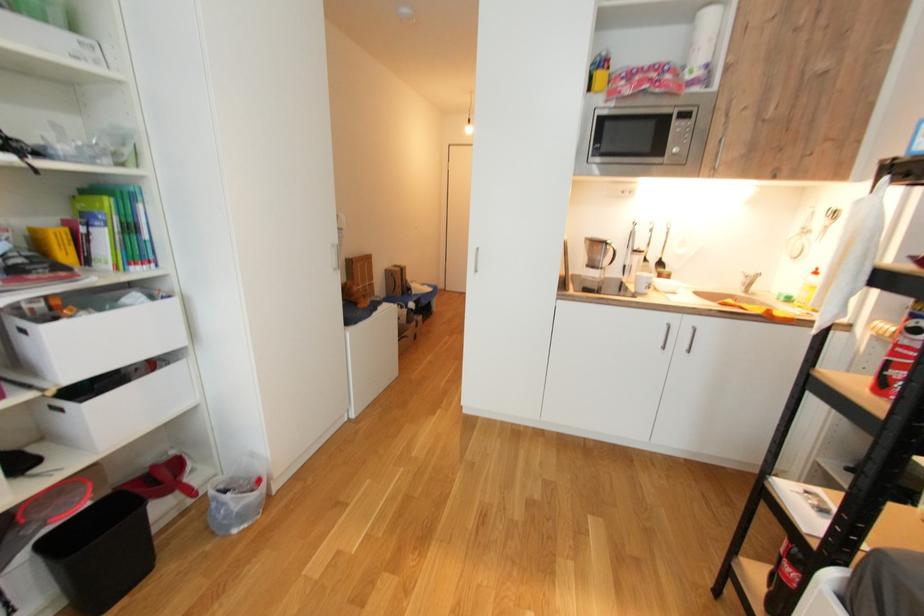
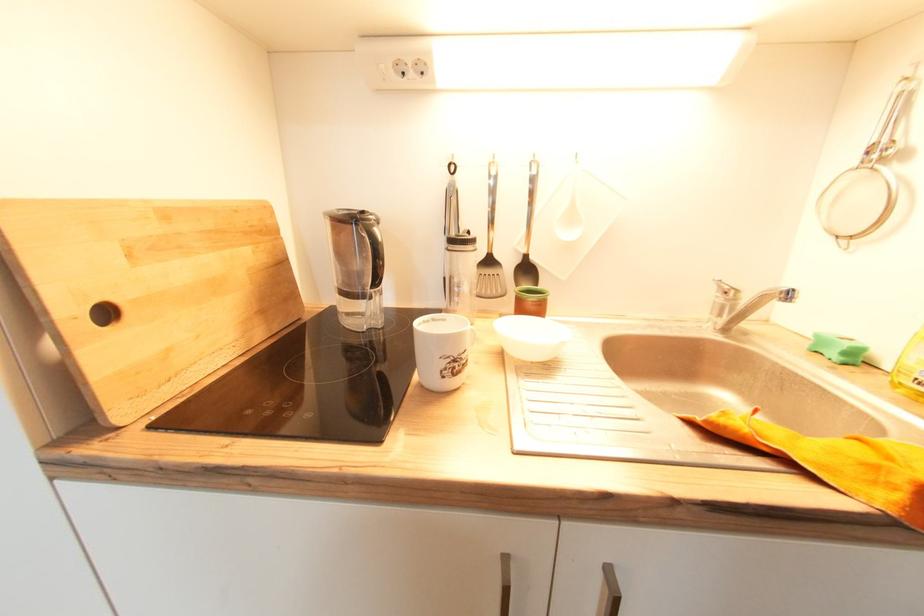
What movement of the cameraman would produce the second image?

The movement direction of the cameraman is right, forward.